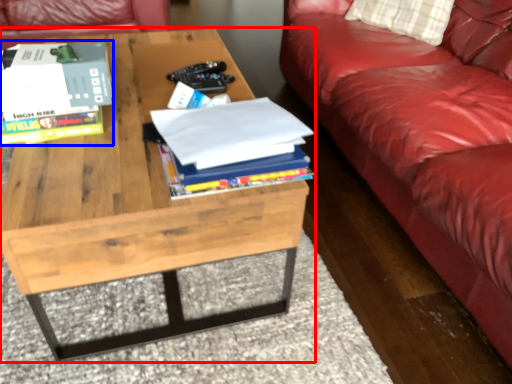
Question: Which object is further to the camera taking this photo, coffee table (highlighted by a red box) or book (highlighted by a blue box)?

Choices:
 (A) coffee table
 (B) book

Answer: (B)